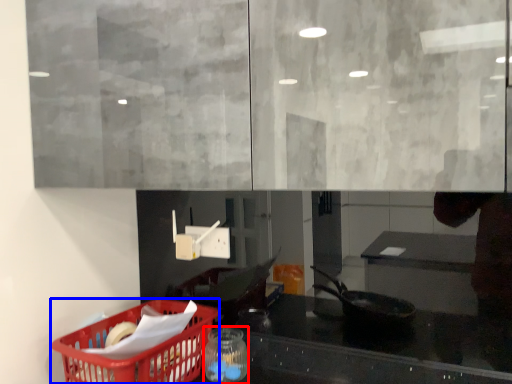
Question: Which of the following is the farthest to the observer, glass jar (highlighted by a red box) or basket (highlighted by a blue box)?

Choices:
 (A) glass jar
 (B) basket

Answer: (A)